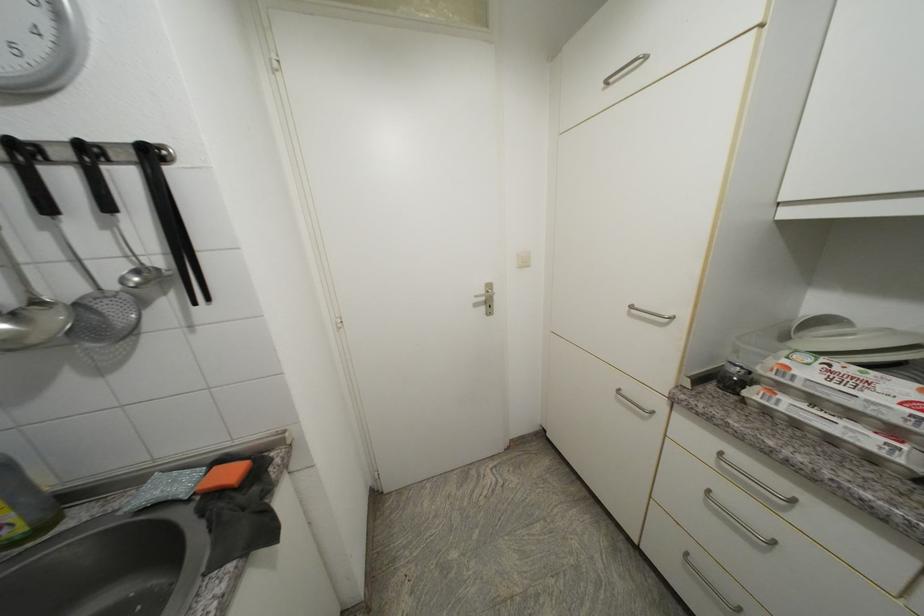
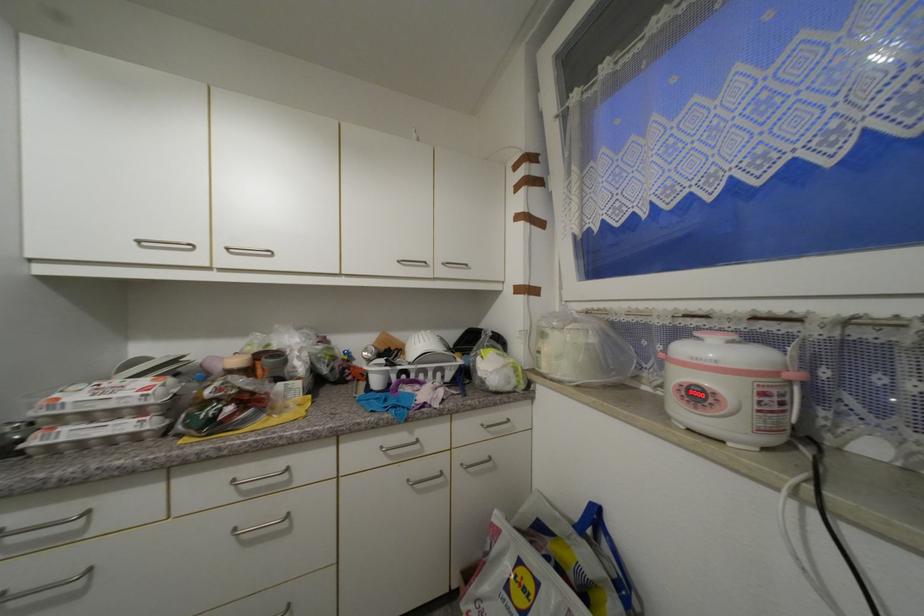
Find the pixel in the second image that matches pixel 795 370 in the first image.

(64, 400)